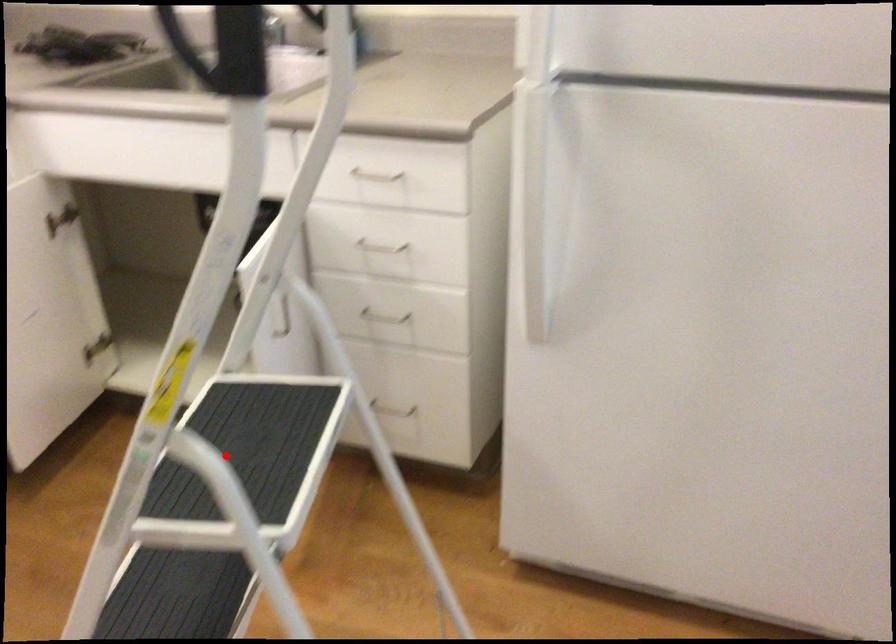
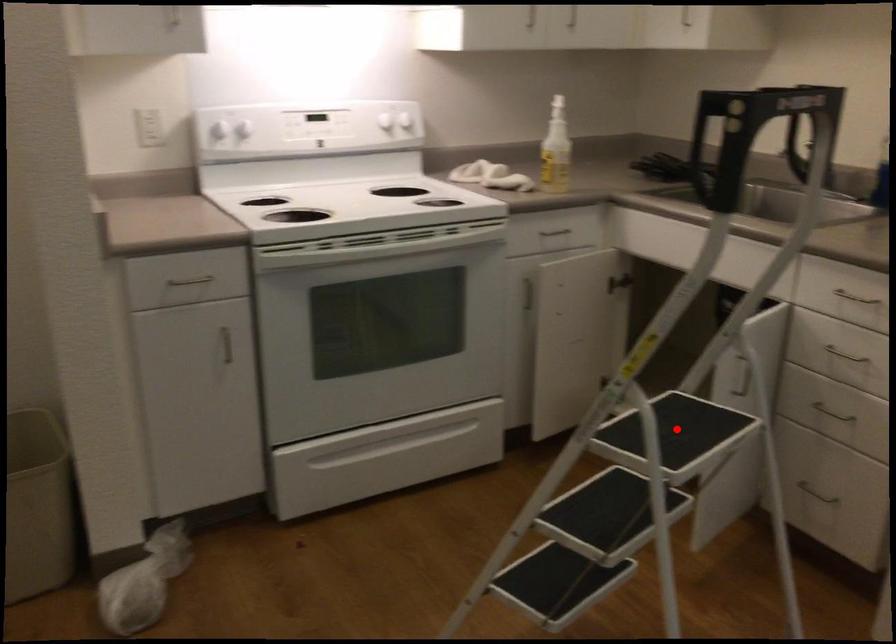
I am providing you with two images of the same scene from different viewpoints. A red point is marked on the first image and another point is marked on the second image. Is the marked point in image1 the same physical position as the marked point in image2?

Yes